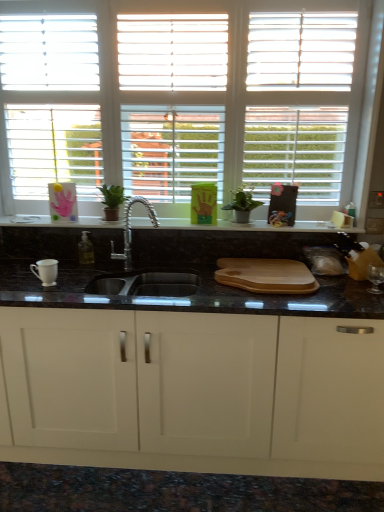
Question: Is green matte plant at center further to camera compared to white matte window at upper center?

Choices:
 (A) no
 (B) yes

Answer: (B)

Question: Is green matte plant at center not within white matte window at upper center?

Choices:
 (A) yes
 (B) no

Answer: (A)

Question: Does green matte plant at center appear on the left side of white matte window at upper center?

Choices:
 (A) no
 (B) yes

Answer: (A)

Question: Is green matte plant at center taller than white matte window at upper center?

Choices:
 (A) yes
 (B) no

Answer: (B)

Question: Are green matte plant at center and white matte window at upper center far apart?

Choices:
 (A) yes
 (B) no

Answer: (B)

Question: Looking at their shapes, would you say white matte window at upper center is wider or thinner than green matte plant at center?

Choices:
 (A) thin
 (B) wide

Answer: (A)

Question: Does point (185, 162) appear closer or farther from the camera than point (228, 208)?

Choices:
 (A) farther
 (B) closer

Answer: (A)

Question: Visually, is white matte window at upper center positioned to the left or to the right of green matte plant at center?

Choices:
 (A) left
 (B) right

Answer: (A)

Question: Considering their positions, is white matte window at upper center located in front of or behind green matte plant at center?

Choices:
 (A) front
 (B) behind

Answer: (A)

Question: Is point (175, 326) closer or farther from the camera than point (16, 216)?

Choices:
 (A) farther
 (B) closer

Answer: (B)

Question: In the image, is white matte cabinet at center positioned in front of or behind black granite cutting board at center?

Choices:
 (A) behind
 (B) front

Answer: (B)

Question: From the image's perspective, relative to black granite cutting board at center, is white matte cabinet at center above or below?

Choices:
 (A) below
 (B) above

Answer: (A)

Question: From a real-world perspective, relative to black granite cutting board at center, is white matte cabinet at center vertically above or below?

Choices:
 (A) above
 (B) below

Answer: (B)

Question: Looking at the image, does wooden cutting board at center seem bigger or smaller compared to white matte window at upper center?

Choices:
 (A) big
 (B) small

Answer: (B)

Question: Relative to white matte window at upper center, is wooden cutting board at center in front or behind?

Choices:
 (A) front
 (B) behind

Answer: (A)